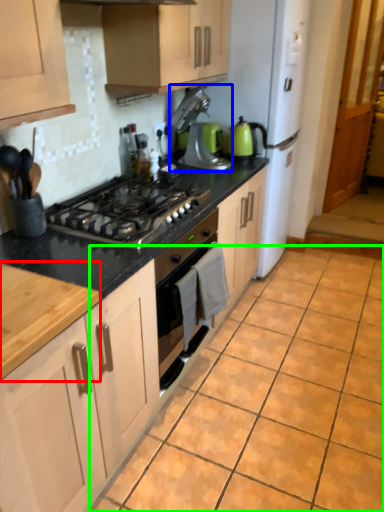
Question: Which object is the closest to the countertop (highlighted by a red box)? Choose among these: kitchen appliance (highlighted by a blue box) or ceramic tile (highlighted by a green box).

Choices:
 (A) kitchen appliance
 (B) ceramic tile

Answer: (B)